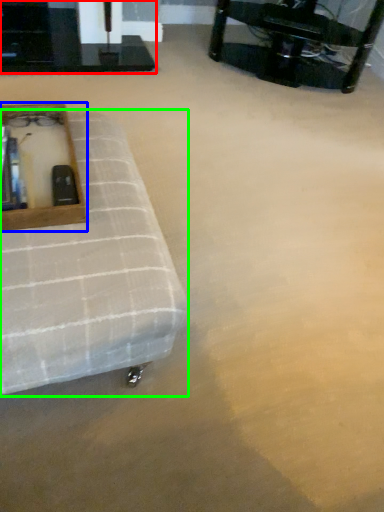
Question: Based on their relative distances, which object is farther from table (highlighted by a red box)? Choose from vanity (highlighted by a blue box) and furniture (highlighted by a green box).

Choices:
 (A) vanity
 (B) furniture

Answer: (B)